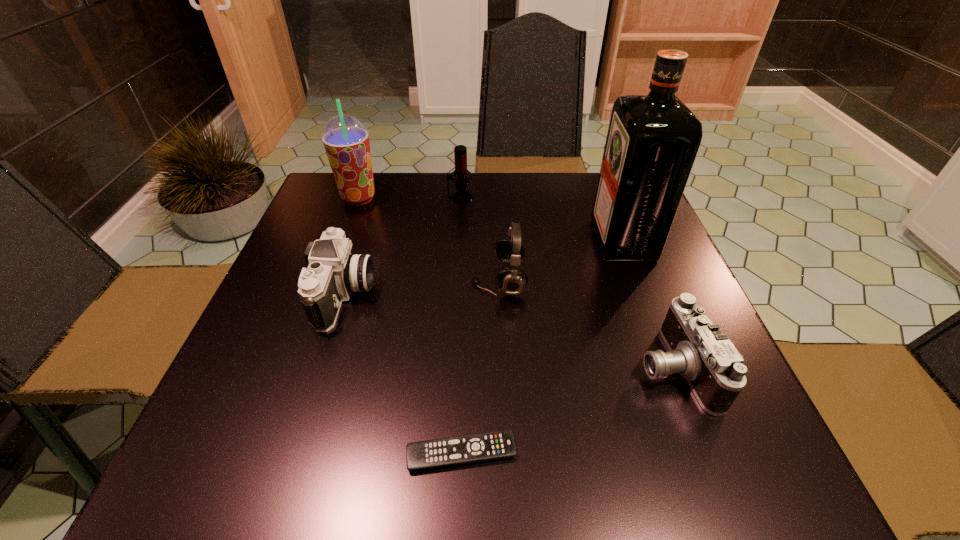
Find the location of `empty space between the microphone and the sixth shortest object`. empty space between the microphone and the sixth shortest object is located at coordinates (409, 198).

Image resolution: width=960 pixels, height=540 pixels. In order to click on free space between the microphone and the smoothie in this screenshot , I will do `click(409, 198)`.

You are a GUI agent. You are given a task and a screenshot of the screen. Output one action in this format:
    pyautogui.click(x=<x>, y=<y>)
    Task: Click on the free space between the second tallest object and the microphone
    The width and height of the screenshot is (960, 540).
    Given the screenshot: What is the action you would take?
    pyautogui.click(x=409, y=198)

Find the location of `blank region between the microphone and the left camera`. blank region between the microphone and the left camera is located at coordinates (402, 246).

The height and width of the screenshot is (540, 960). Find the location of `vacant region between the headset and the remote control`. vacant region between the headset and the remote control is located at coordinates (480, 367).

You are a GUI agent. You are given a task and a screenshot of the screen. Output one action in this format:
    pyautogui.click(x=<x>, y=<y>)
    Task: Click on the free space that is in between the nearest object and the left camera
    
    Given the screenshot: What is the action you would take?
    pyautogui.click(x=403, y=374)

Where is `vacant area that lies between the right camera and the microphone`? The height and width of the screenshot is (540, 960). vacant area that lies between the right camera and the microphone is located at coordinates (566, 282).

Identify the location of the fifth closest object to the sixth shortest object. This screenshot has width=960, height=540. (450, 451).

What are the coordinates of `object that ranks as the closest to the microphone` in the screenshot? It's located at (346, 140).